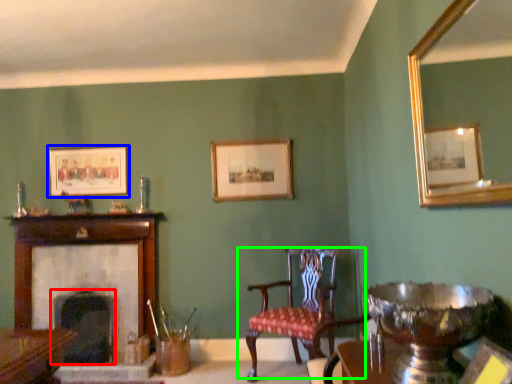
Question: Based on their relative distances, which object is nearer to fireplace (highlighted by a red box)? Choose from picture frame (highlighted by a blue box) and chair (highlighted by a green box).

Choices:
 (A) picture frame
 (B) chair

Answer: (A)